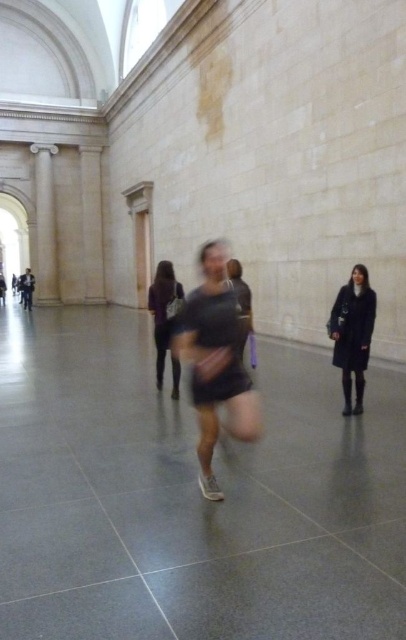
Question: Estimate the real-world distances between objects in this image. Which object is closer to the dark gray fabric dress at center?

Choices:
 (A) white marble pillar at left
 (B) black matte shirt at center
 (C) dark blue coat at right

Answer: (C)

Question: Does black matte shirt at center appear over dark gray fabric dress at center?

Choices:
 (A) no
 (B) yes

Answer: (A)

Question: Is the position of dark blue coat at right more distant than that of dark gray fabric dress at center?

Choices:
 (A) no
 (B) yes

Answer: (A)

Question: Can you confirm if dark blue coat at right is wider than dark gray fabric dress at center?

Choices:
 (A) no
 (B) yes

Answer: (A)

Question: Which point is farther to the camera?

Choices:
 (A) dark gray fabric dress at center
 (B) black matte shirt at center

Answer: (A)

Question: Which point is farther from the camera taking this photo?

Choices:
 (A) [45, 202]
 (B) [202, 438]
 (C) [151, 307]

Answer: (A)